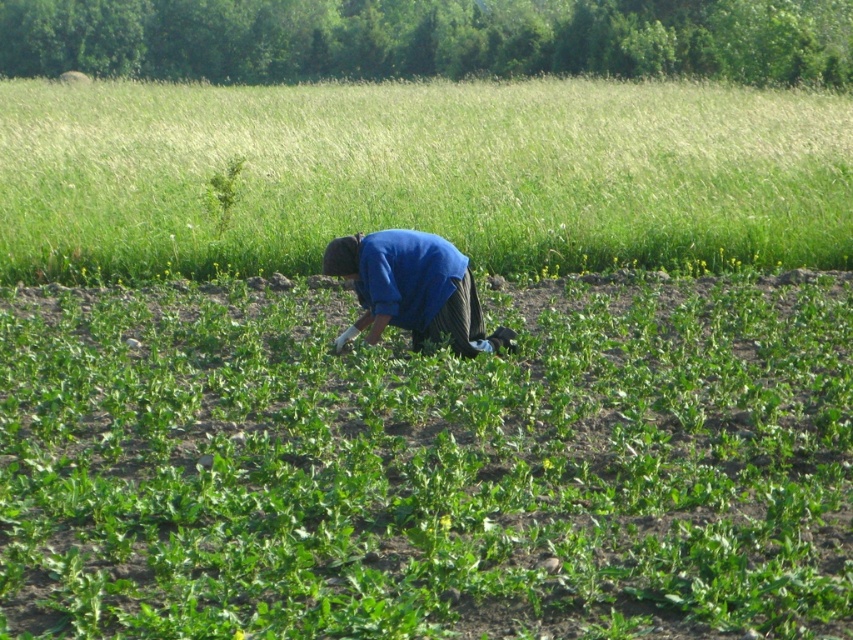
Which is more to the right, green grass at center or blue fabric at center?

From the viewer's perspective, blue fabric at center appears more on the right side.

Between green grass at center and blue fabric at center, which one has less height?

Standing shorter between the two is blue fabric at center.

Is point (155, 124) farther from viewer compared to point (409, 298)?

Yes, point (155, 124) is behind point (409, 298).

Identify the location of green grass at center. (421, 173).

Who is more forward, (421,531) or (379,289)?

Point (421,531)

Find the location of a particular element. This screenshot has width=853, height=640. green leafy grass at center is located at coordinates (428, 465).

Does green leafy grass at center have a lesser height compared to green grass at center?

Yes.

Who is taller, green leafy grass at center or green grass at center?

Standing taller between the two is green grass at center.

At what (x,y) coordinates should I click in order to perform the action: click on green leafy grass at center. Please return your answer as a coordinate pair (x, y). The image size is (853, 640). Looking at the image, I should click on (428, 465).